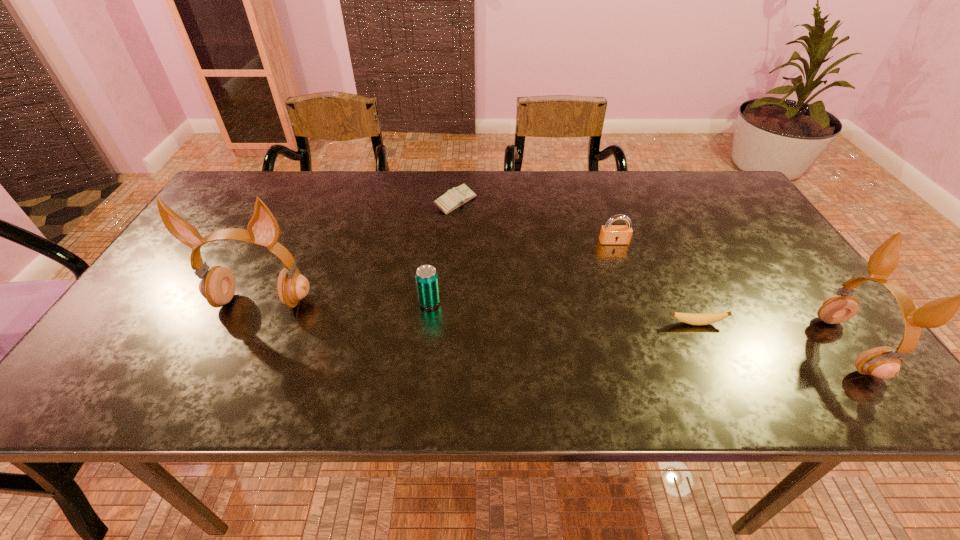
Please mark a free spot for a new earphone to balance the arrangement. Please provide its 2D coordinates. Your answer should be formatted as a tuple, i.e. [(x, y)], where the tuple contains the x and y coordinates of a point satisfying the conditions above.

[(540, 322)]